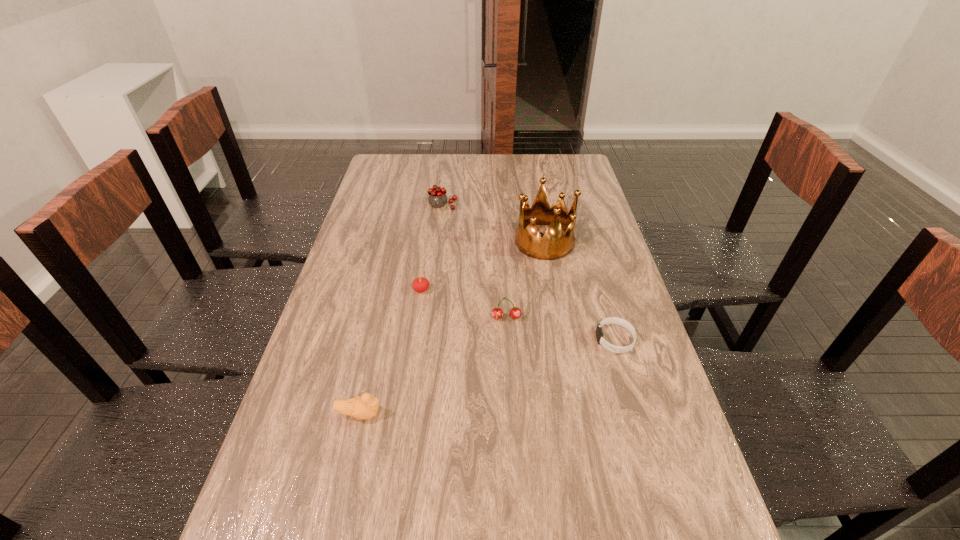
This screenshot has height=540, width=960. I want to click on the second farthest object, so click(x=554, y=245).

Locate an element on the screen. The image size is (960, 540). the tallest object is located at coordinates click(x=554, y=245).

The width and height of the screenshot is (960, 540). In order to click on the farthest cherry in this screenshot , I will do `click(437, 198)`.

This screenshot has width=960, height=540. What are the coordinates of `the farthest object` in the screenshot? It's located at (437, 198).

You are a GUI agent. You are given a task and a screenshot of the screen. Output one action in this format:
    pyautogui.click(x=<x>, y=<y>)
    Task: Click on the third farthest object
    The width and height of the screenshot is (960, 540).
    Given the screenshot: What is the action you would take?
    pyautogui.click(x=421, y=284)

This screenshot has width=960, height=540. I want to click on the fourth object from left to right, so click(x=497, y=313).

This screenshot has height=540, width=960. I want to click on the third nearest object, so click(x=497, y=313).

You are a GUI agent. You are given a task and a screenshot of the screen. Output one action in this format:
    pyautogui.click(x=<x>, y=<y>)
    Task: Click on the duckling
    Image resolution: width=960 pixels, height=540 pixels.
    Given the screenshot: What is the action you would take?
    pyautogui.click(x=365, y=407)

Find the location of a particular element. The image size is (960, 540). the nearest object is located at coordinates (365, 407).

At what (x,y) coordinates should I click in order to perform the action: click on the fifth farthest object. Please return your answer as a coordinate pair (x, y). The image size is (960, 540). Looking at the image, I should click on (610, 320).